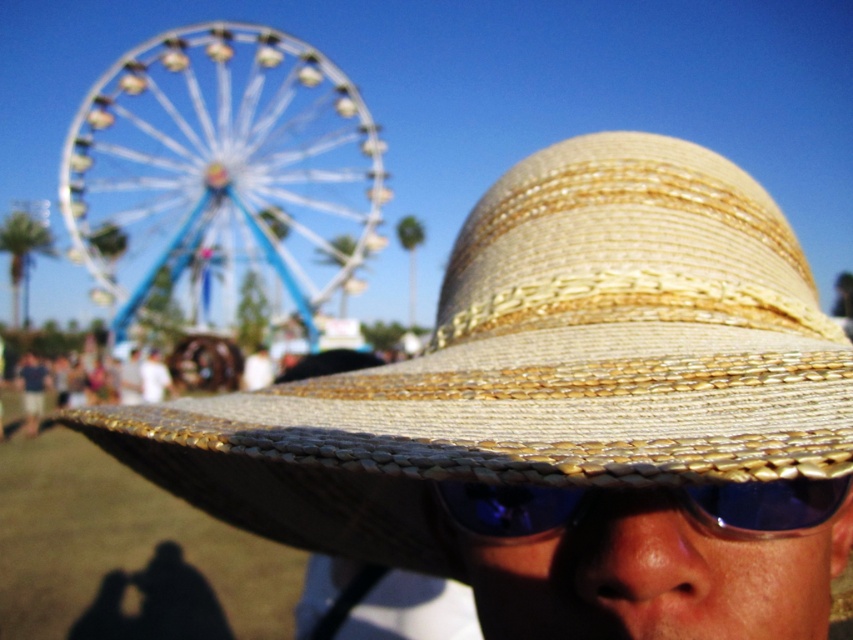
You are a photographer trying to capture the metallic blue ferris wheel at upper left and the blue reflective plastic goggles at center in a single shot. Which object should you focus on to ensure the taller one is in sharp focus?

The metallic blue ferris wheel at upper left is taller than the blue reflective plastic goggles at center, so you should focus on the metallic blue ferris wheel at upper left to ensure it is in sharp focus.

You are at a fair and want to take a photo of yourself wearing both the natural straw hat at center and the blue reflective plastic goggles at center. If you want the hat to appear bigger in the photo than the goggles, where should you position them?

The natural straw hat at center is already larger in size compared to the blue reflective plastic goggles at center, so to make the hat appear even bigger, you can position it closer to the camera while keeping the goggles further away.

You are a photographer trying to capture the natural straw hat at center in focus while also wanting the Ferris wheel in the background to be somewhat visible. Based on the scene description, can you determine if the distance between the hat and the camera allows for both the hat and the Ferris wheel to be in focus?

The natural straw hat at center is 17.15 inches from the camera. Since the Ferris wheel is in the background and the hat is very close to the camera, it would be challenging to have both in focus simultaneously. The shallow depth of field at such a close distance likely blurs the background, making the Ferris wheel appear out of focus.